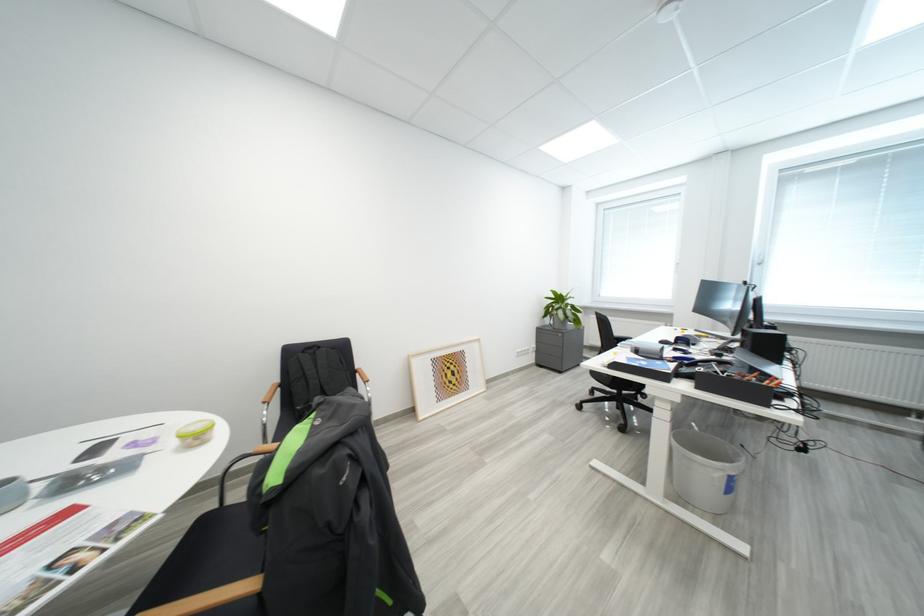
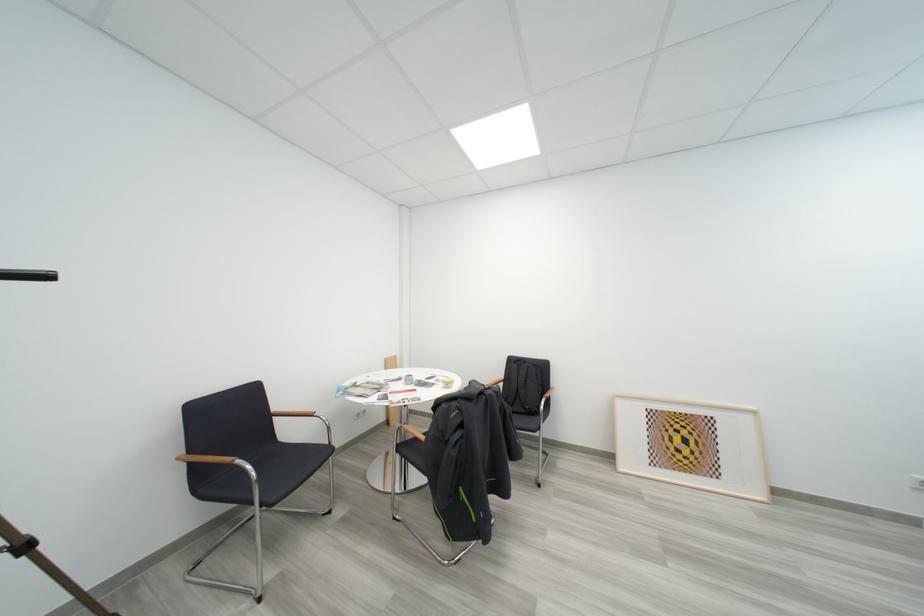
Find the pixel in the second image that matches point (460, 370) in the first image.

(693, 435)